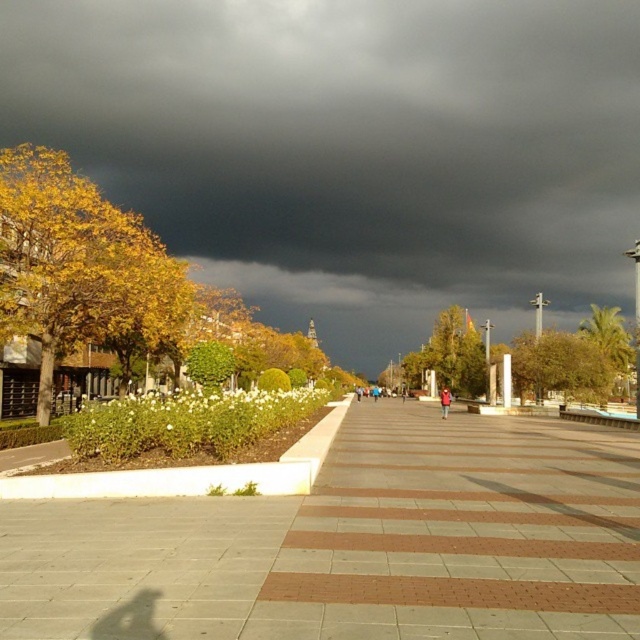
What do you see at coordinates (353, 148) in the screenshot?
I see `dark gray cloud at upper center` at bounding box center [353, 148].

Can you confirm if dark gray cloud at upper center is taller than brown tiled pavement at center?

Yes.

Is point (419, 40) more distant than point (292, 541)?

Yes, it is behind point (292, 541).

At what (x,y) coordinates should I click in order to perform the action: click on dark gray cloud at upper center. Please return your answer as a coordinate pair (x, y). Looking at the image, I should click on (353, 148).